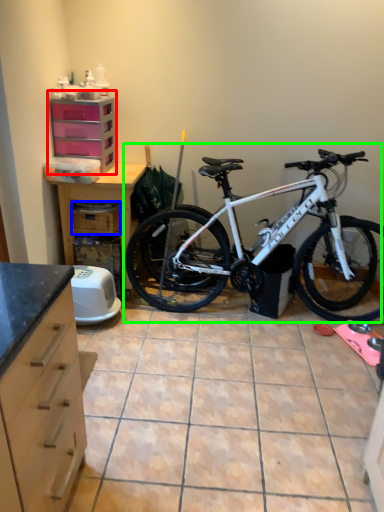
Question: Estimate the real-world distances between objects in this image. Which object is farther from file cabinet (highlighted by a red box), crate (highlighted by a blue box) or bicycle (highlighted by a green box)?

Choices:
 (A) crate
 (B) bicycle

Answer: (B)